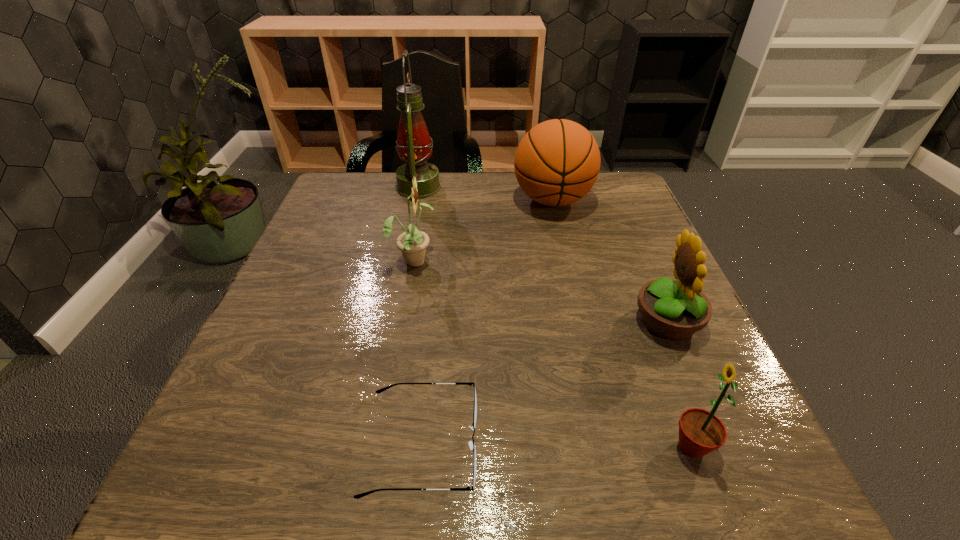
The height and width of the screenshot is (540, 960). In order to click on empty location between the nearest sunflower and the oil lamp in this screenshot , I will do `click(555, 318)`.

Where is `object that is the second nearest to the nearest sunflower`? The image size is (960, 540). object that is the second nearest to the nearest sunflower is located at coordinates (472, 445).

Locate which object is the fourth closest to the basketball. Please provide its 2D coordinates. Your answer should be formatted as a tuple, i.e. [(x, y)], where the tuple contains the x and y coordinates of a point satisfying the conditions above.

[(472, 445)]

Identify which sunflower is located as the nearest to the nearest sunflower. Please provide its 2D coordinates. Your answer should be formatted as a tuple, i.e. [(x, y)], where the tuple contains the x and y coordinates of a point satisfying the conditions above.

[(674, 310)]

Identify the location of sunflower that stands as the third closest to the oil lamp. The height and width of the screenshot is (540, 960). (700, 432).

The height and width of the screenshot is (540, 960). Find the location of `free region that satisfies the following two spatial constraints: 1. on the front side of the basketball; 2. on the front-facing side of the farthest sunflower`. free region that satisfies the following two spatial constraints: 1. on the front side of the basketball; 2. on the front-facing side of the farthest sunflower is located at coordinates (566, 260).